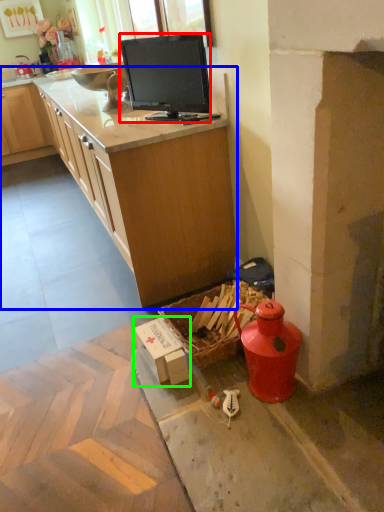
Question: Which object is the closest to the television (highlighted by a red box)? Choose among these: countertop (highlighted by a blue box) or cardboard box (highlighted by a green box).

Choices:
 (A) countertop
 (B) cardboard box

Answer: (A)